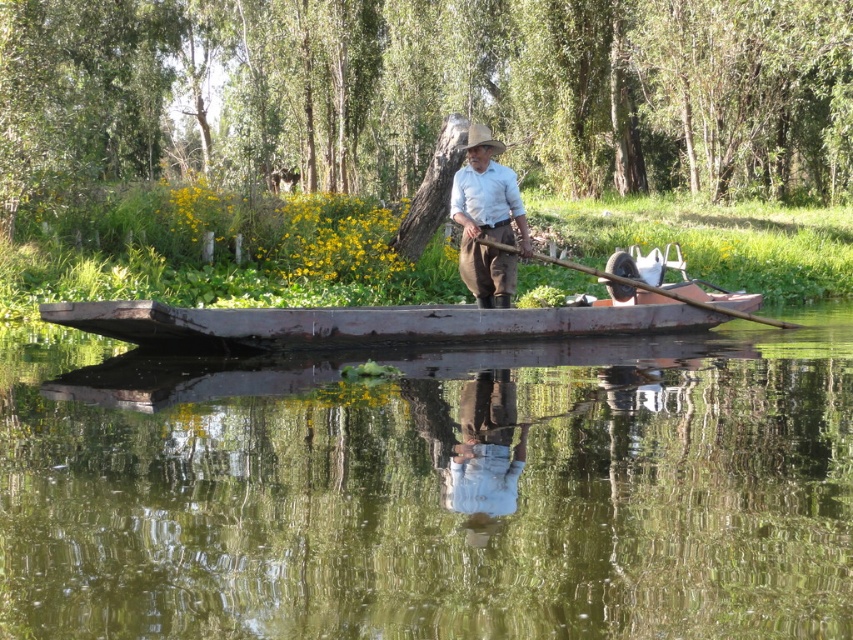
You are standing on the dock and see the green smooth water at center and the wooden at center. Which one is higher from the ground?

The green smooth water at center is taller than wooden at center, so the green smooth water at center is higher from the ground.

You are a photographer taking a picture of the light brown cotton shirt at center and the wooden at center. Which object should you focus on first if you want to capture both clearly in the same frame?

The light brown cotton shirt at center is above the wooden at center, so you should focus on the light brown cotton shirt at center first to ensure both are in focus.